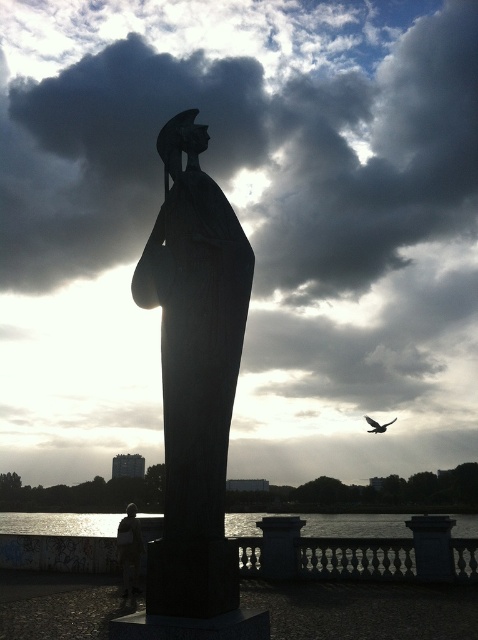
Question: Among these points, which one is nearest to the camera?

Choices:
 (A) (33, 525)
 (B) (47, 556)
 (C) (371, 420)

Answer: (B)

Question: Can you confirm if black stone statue at center is positioned to the right of dark feathered bird at upper right?

Choices:
 (A) no
 (B) yes

Answer: (A)

Question: Which of the following is the closest to the observer?

Choices:
 (A) (47, 524)
 (B) (127, 566)
 (C) (188, 496)
 (D) (373, 429)

Answer: (C)

Question: Which of the following is the closest to the observer?

Choices:
 (A) glistening water at lower center
 (B) dark gray concrete statue at center
 (C) dark feathered bird at upper right
 (D) reflective glass water at lower center

Answer: (A)

Question: Does black stone statue at center have a smaller size compared to reflective glass water at lower center?

Choices:
 (A) no
 (B) yes

Answer: (B)

Question: Can you confirm if glistening water at lower center is positioned to the left of dark feathered bird at upper right?

Choices:
 (A) yes
 (B) no

Answer: (A)